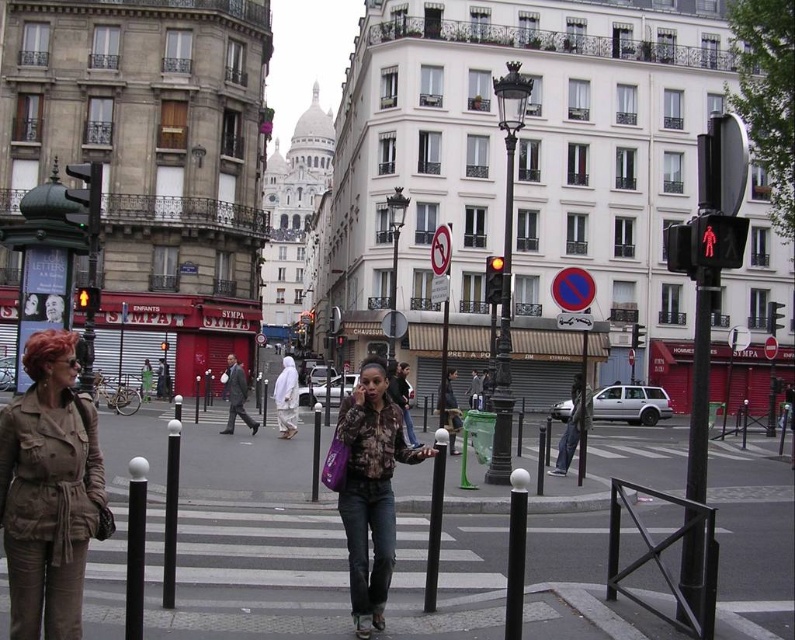
Which of these two, yellow glass traffic light at center or metallic traffic light at center, stands shorter?

metallic traffic light at center is shorter.

Measure the distance between yellow glass traffic light at center and camera.

yellow glass traffic light at center and camera are 133.04 feet apart from each other.

Find the location of a particular element. Image resolution: width=795 pixels, height=640 pixels. yellow glass traffic light at center is located at coordinates (493, 280).

Is the position of metallic red traffic light at center less distant than that of metallic traffic light at center?

Yes, it is in front of metallic traffic light at center.

Does metallic red traffic light at center have a smaller size compared to metallic traffic light at center?

Indeed, metallic red traffic light at center has a smaller size compared to metallic traffic light at center.

Identify the location of metallic red traffic light at center. The width and height of the screenshot is (795, 640). (638, 336).

Can you confirm if matte brown trench coat at lower left is taller than metallic traffic light at upper right?

Correct, matte brown trench coat at lower left is much taller as metallic traffic light at upper right.

Which is more to the right, matte brown trench coat at lower left or metallic traffic light at upper right?

Positioned to the right is metallic traffic light at upper right.

I want to click on matte brown trench coat at lower left, so click(x=49, y=490).